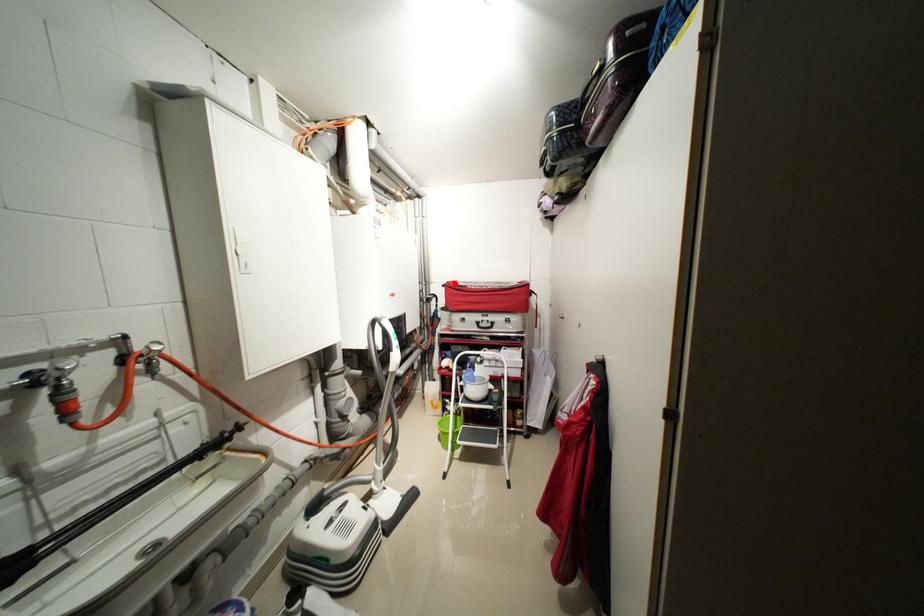
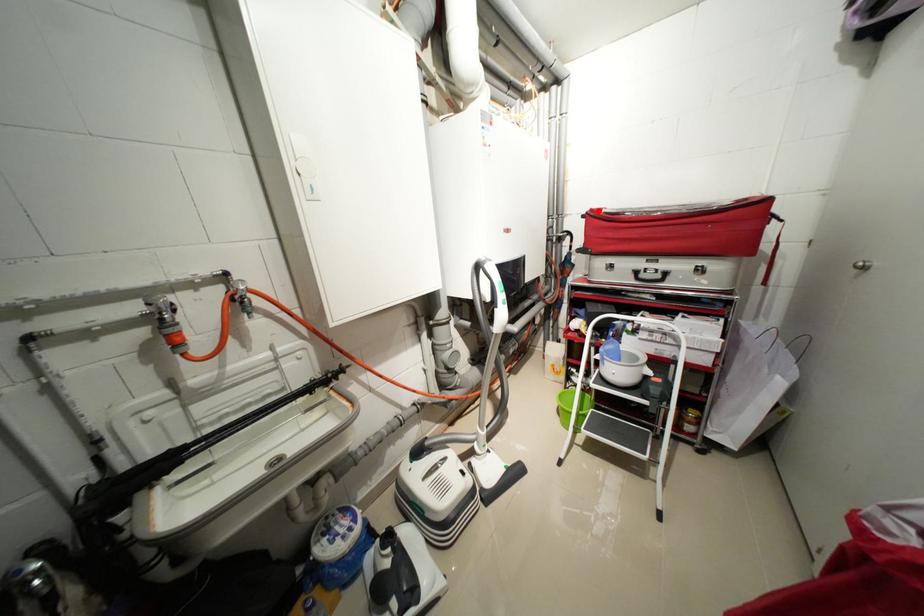
I am providing you with two images of the same scene from different viewpoints. A red point is marked on the first image and another point is marked on the second image. Does the point marked in image1 correspond to the same location as the one in image2?

Yes